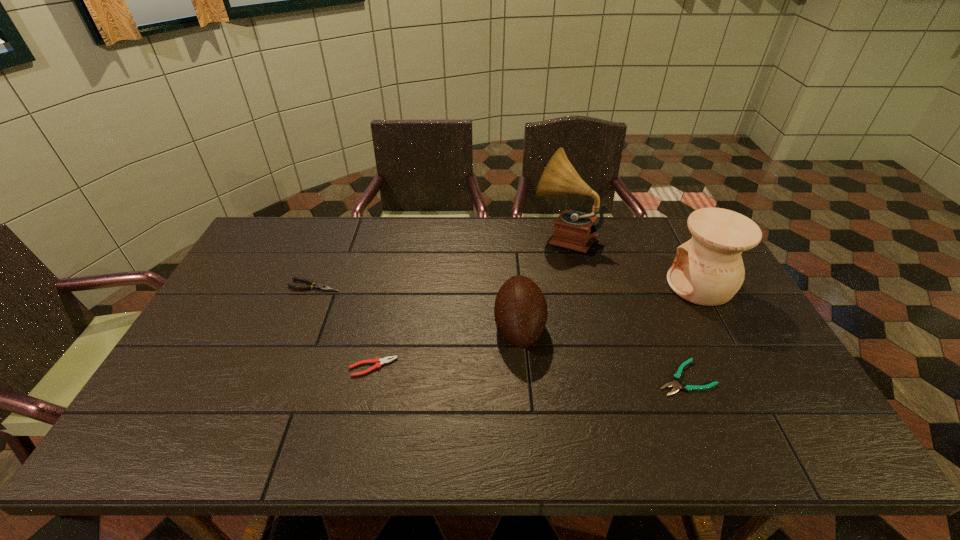
This screenshot has height=540, width=960. What are the coordinates of `vacant space that's between the shortest pliers and the tallest pliers` in the screenshot? It's located at (500, 332).

Where is `free spot between the rightmost pliers and the second tallest object`? free spot between the rightmost pliers and the second tallest object is located at coordinates (692, 332).

Locate an element on the screen. Image resolution: width=960 pixels, height=540 pixels. vacant point located between the tallest pliers and the second shortest pliers is located at coordinates (344, 326).

At what (x,y) coordinates should I click in order to perform the action: click on blank region between the tallest pliers and the fifth tallest object. Please return your answer as a coordinate pair (x, y). The width and height of the screenshot is (960, 540). Looking at the image, I should click on (344, 326).

At what (x,y) coordinates should I click in order to perform the action: click on vacant space in between the phonograph record and the fourth shortest object. Please return your answer as a coordinate pair (x, y). The width and height of the screenshot is (960, 540). Looking at the image, I should click on (541, 282).

The width and height of the screenshot is (960, 540). Identify the location of vacant space that's between the phonograph record and the fourth shortest object. (541, 282).

Identify the location of free point between the football and the fifth shortest object. (610, 306).

Identify the location of free space that is in between the second tallest object and the farthest object. This screenshot has height=540, width=960. (632, 261).

This screenshot has height=540, width=960. What are the coordinates of `vacant space that's between the shortest pliers and the tallest object` in the screenshot? It's located at (624, 307).

This screenshot has height=540, width=960. Identify the location of vacant area that lies between the phonograph record and the football. (541, 282).